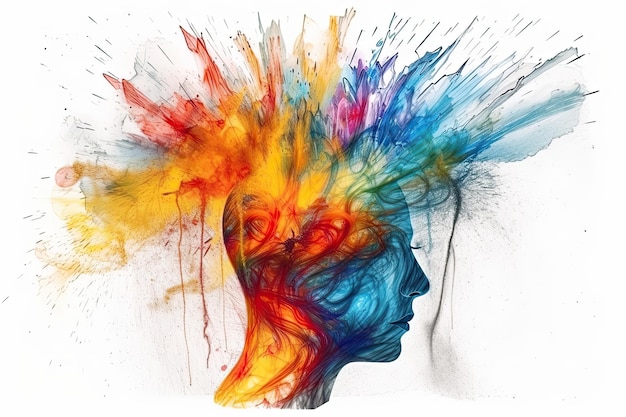
At what (x,y) coordinates should I click in order to perform the action: click on orange paint. Please return your answer as a coordinate pair (x, y). Image resolution: width=626 pixels, height=417 pixels. Looking at the image, I should click on (265, 371), (143, 204), (269, 176), (237, 131), (326, 76), (315, 187), (339, 190), (359, 232).